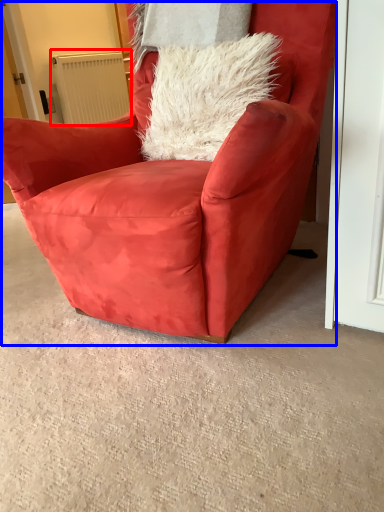
Question: Which object appears farthest to the camera in this image, radiator (highlighted by a red box) or chair (highlighted by a blue box)?

Choices:
 (A) radiator
 (B) chair

Answer: (A)